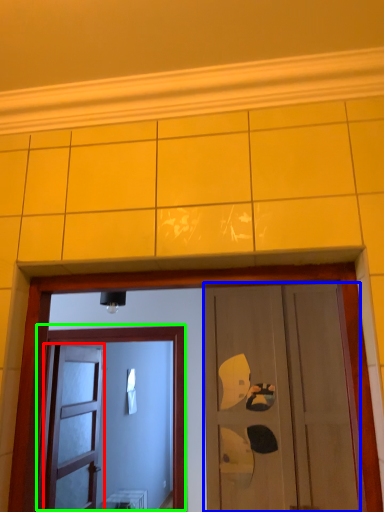
Question: Estimate the real-world distances between objects in this image. Which object is farther from door (highlighted by a red box), door (highlighted by a blue box) or door (highlighted by a green box)?

Choices:
 (A) door
 (B) door

Answer: (A)